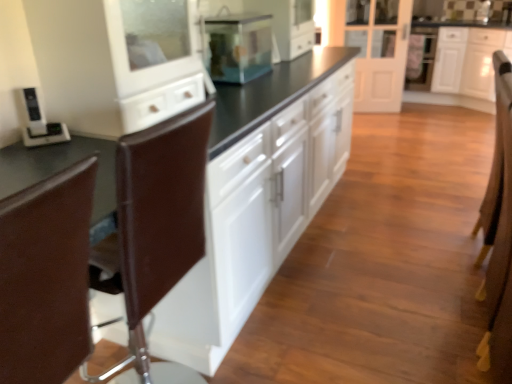
Question: Is brown leather armchair at right positioned beyond the bounds of white glossy cabinets at center, which appears as the 1th cabinetry when viewed from the left?

Choices:
 (A) yes
 (B) no

Answer: (A)

Question: Is brown leather armchair at right oriented towards white glossy cabinets at center, the first cabinetry viewed from the front?

Choices:
 (A) yes
 (B) no

Answer: (B)

Question: Can you confirm if brown leather armchair at right is thinner than white glossy cabinets at center, which appears as the 1th cabinetry when viewed from the left?

Choices:
 (A) yes
 (B) no

Answer: (A)

Question: Is brown leather armchair at right positioned before white glossy cabinets at center, the 2th cabinetry in the right-to-left sequence?

Choices:
 (A) no
 (B) yes

Answer: (A)

Question: Can you confirm if brown leather armchair at right is wider than white glossy cabinets at center, the first cabinetry viewed from the front?

Choices:
 (A) no
 (B) yes

Answer: (A)

Question: Is brown leather armchair at right smaller than white glossy cabinets at center, the 2th cabinetry from the back?

Choices:
 (A) no
 (B) yes

Answer: (B)

Question: Does brown leather swivel chair at left, arranged as the 2th swivel chair when viewed from the back, have a greater height compared to brown leather swivel chair at left, which is the 2th swivel chair from front to back?

Choices:
 (A) yes
 (B) no

Answer: (B)

Question: Is brown leather swivel chair at left, arranged as the 2th swivel chair when viewed from the back, to the right of brown leather swivel chair at left, which is the 2th swivel chair from front to back, from the viewer's perspective?

Choices:
 (A) yes
 (B) no

Answer: (A)

Question: Is brown leather swivel chair at left, which is the 2th swivel chair from front to back, inside brown leather swivel chair at left, arranged as the 2th swivel chair when viewed from the back?

Choices:
 (A) no
 (B) yes

Answer: (A)

Question: From a real-world perspective, is brown leather swivel chair at left, arranged as the 2th swivel chair when viewed from the back, physically below brown leather swivel chair at left, arranged as the first swivel chair when viewed from the back?

Choices:
 (A) no
 (B) yes

Answer: (A)

Question: Does brown leather swivel chair at left, which ranks as the 1th swivel chair in front-to-back order, have a larger size compared to brown leather swivel chair at left, arranged as the first swivel chair when viewed from the back?

Choices:
 (A) no
 (B) yes

Answer: (A)

Question: Is brown leather swivel chair at left, which ranks as the 1th swivel chair in front-to-back order, facing away from brown leather swivel chair at left, which is the 2th swivel chair from front to back?

Choices:
 (A) yes
 (B) no

Answer: (A)

Question: Is white glossy cabinets at center, the first cabinetry viewed from the front, at the left side of white glossy cabinet at upper right, which is the first cabinetry in back-to-front order?

Choices:
 (A) yes
 (B) no

Answer: (A)